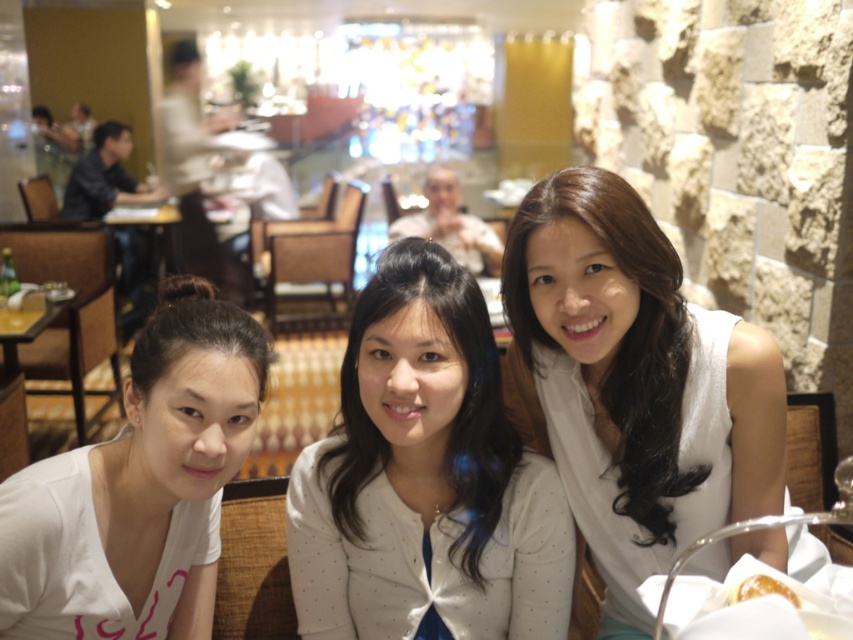
Is white matte dress at center closer to camera compared to white matte shirt at left?

That is False.

Is white matte dress at center further to camera compared to white matte shirt at left?

That is True.

Locate an element on the screen. This screenshot has height=640, width=853. white matte dress at center is located at coordinates (634, 385).

Is white matte shirt at left shorter than golden glazed donut at lower right?

No, white matte shirt at left is not shorter than golden glazed donut at lower right.

This screenshot has height=640, width=853. Describe the element at coordinates (138, 486) in the screenshot. I see `white matte shirt at left` at that location.

This screenshot has height=640, width=853. What are the coordinates of `white matte shirt at left` in the screenshot? It's located at (138, 486).

Can you confirm if white dotted cardigan at center is positioned to the right of white matte shirt at left?

Correct, you'll find white dotted cardigan at center to the right of white matte shirt at left.

Is point (457, 365) positioned after point (151, 502)?

Yes, it is behind point (151, 502).

I want to click on white dotted cardigan at center, so click(425, 477).